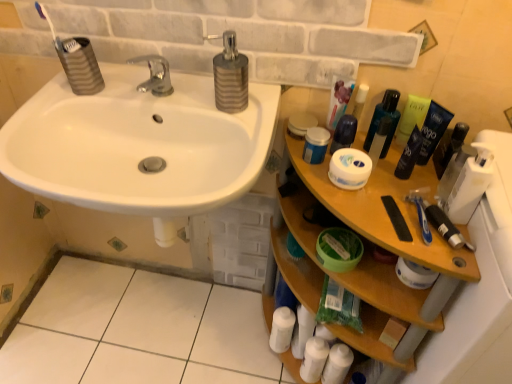
This screenshot has height=384, width=512. What are the coordinates of `vacant area located to the right-hand side of white matte jar at upper right, which appears as the second mouthwash when viewed from the left` in the screenshot? It's located at (397, 163).